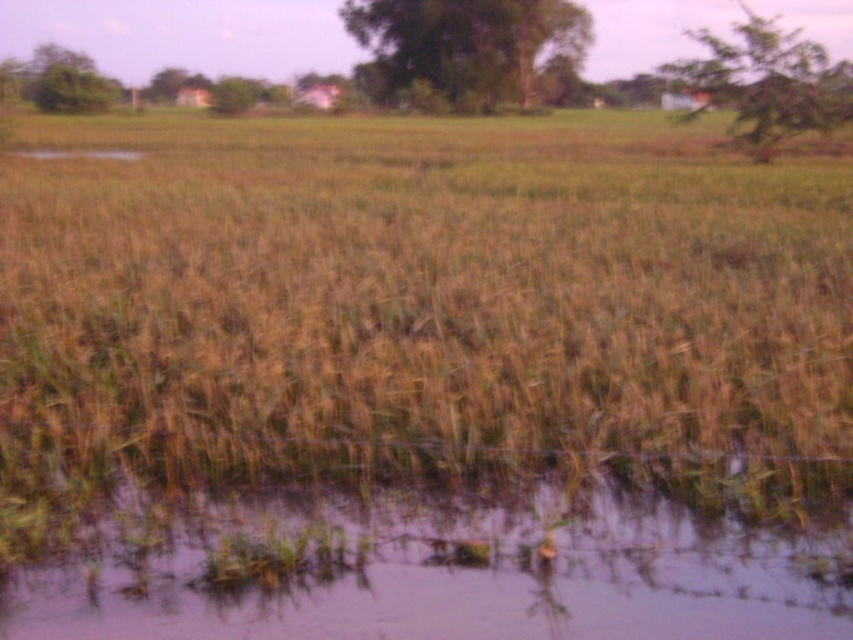
Question: Where is brown grass at center located in relation to translucent muddy water at lower center in the image?

Choices:
 (A) right
 (B) left

Answer: (B)

Question: Which point is closer to the camera taking this photo?

Choices:
 (A) (759, 577)
 (B) (99, 372)

Answer: (A)

Question: Is brown grass at center to the right of translucent muddy water at lower center from the viewer's perspective?

Choices:
 (A) yes
 (B) no

Answer: (B)

Question: Can you confirm if brown grass at center is bigger than translucent muddy water at lower center?

Choices:
 (A) yes
 (B) no

Answer: (A)

Question: Which point is farther to the camera?

Choices:
 (A) translucent muddy water at lower center
 (B) brown grass at center

Answer: (B)

Question: Which object appears farthest from the camera in this image?

Choices:
 (A) translucent muddy water at lower center
 (B) brown grass at center

Answer: (B)